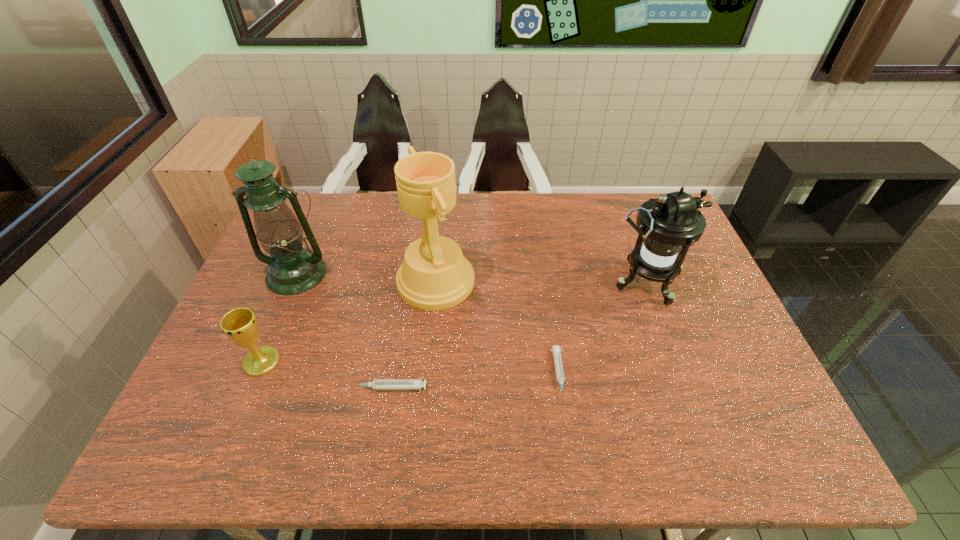
This screenshot has height=540, width=960. In order to click on free space between the chalice and the left syringe in this screenshot , I will do `click(324, 375)`.

Where is `object that stands as the closest to the award`? The width and height of the screenshot is (960, 540). object that stands as the closest to the award is located at coordinates (377, 384).

This screenshot has width=960, height=540. I want to click on the third closest object relative to the chalice, so click(x=434, y=275).